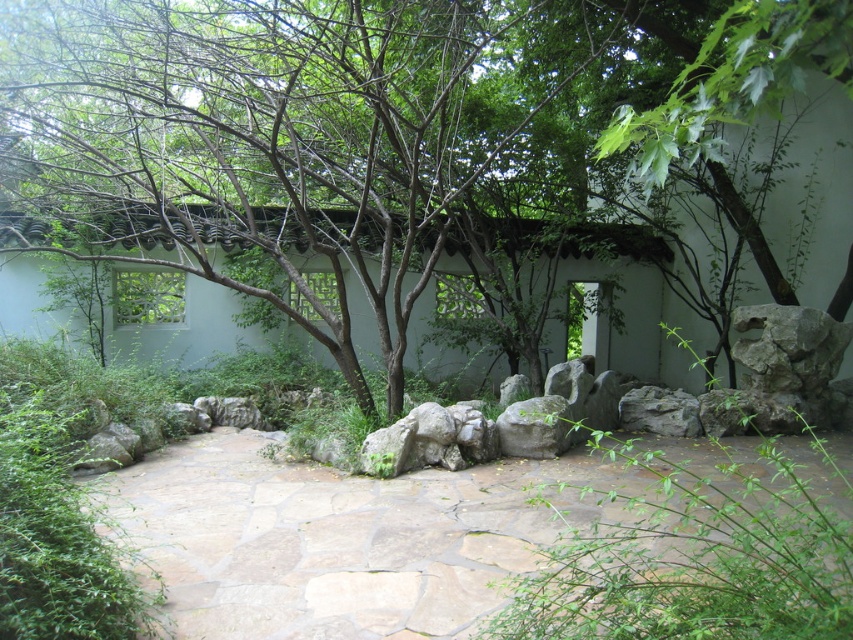
Question: Which object is the farthest from the gray rough rock at right?

Choices:
 (A) gray rough stone at center
 (B) gray rough rock at center
 (C) green leafy tree at center

Answer: (C)

Question: Can you confirm if gray rough rock at right is bigger than gray rough rock at center?

Choices:
 (A) no
 (B) yes

Answer: (B)

Question: Is gray rough rock at right thinner than gray rough rock at center?

Choices:
 (A) yes
 (B) no

Answer: (B)

Question: Which of the following is the closest to the observer?

Choices:
 (A) (801, 324)
 (B) (659, 403)
 (C) (88, 122)

Answer: (A)

Question: Among these objects, which one is farthest from the camera?

Choices:
 (A) gray rough rock at center
 (B) green leafy tree at center
 (C) gray rough stone at center
 (D) natural stone path at center

Answer: (A)

Question: Can you confirm if gray rough stone at center is positioned to the left of gray rough rock at center?

Choices:
 (A) no
 (B) yes

Answer: (B)